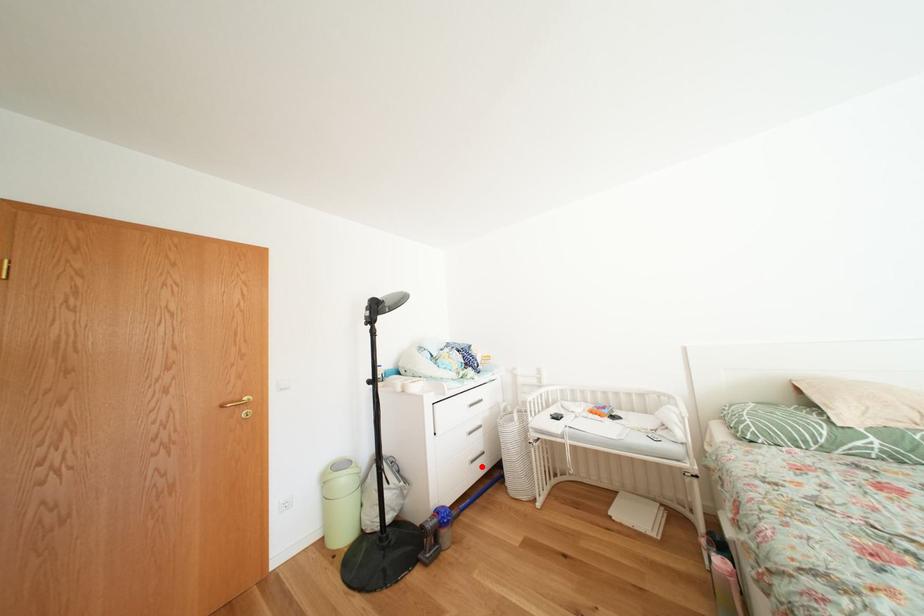
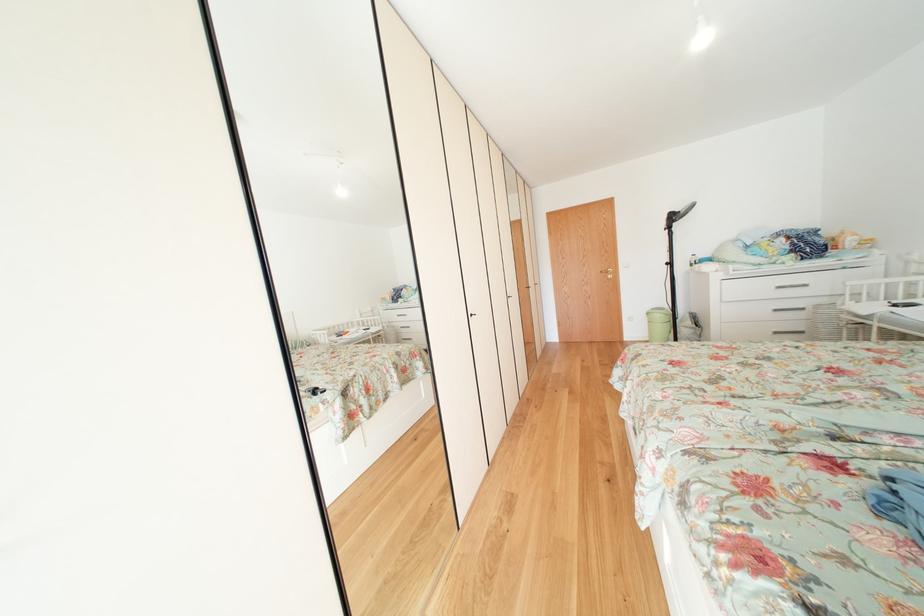
Question: A red point is marked in image1. In image2, is the corresponding 3D point closer to the camera or farther? Reply with the corresponding letter.

Choices:
 (A) The corresponding 3D point is closer.
 (B) The corresponding 3D point is farther.

Answer: (A)